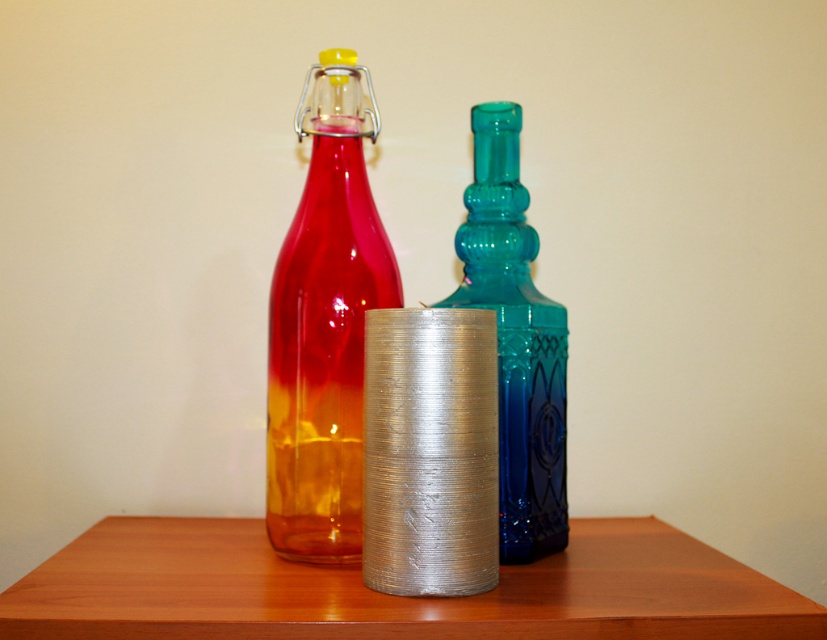
Which is below, wooden table at center or translucent amber glass bottle at center?

Positioned lower is wooden table at center.

Does point (369, 614) come farther from viewer compared to point (367, 243)?

No, (369, 614) is in front of (367, 243).

Find the location of `wooden table at center`. wooden table at center is located at coordinates (390, 595).

Locate an element on the screen. wooden table at center is located at coordinates point(390,595).

Can you confirm if wooden table at center is taller than translucent blue glass bottle at center?

In fact, wooden table at center may be shorter than translucent blue glass bottle at center.

Does point (295, 582) lie in front of point (504, 324)?

Yes.

Between point (185, 554) and point (495, 156), which one is positioned behind?

The point (495, 156) is behind.

Identify the location of wooden table at center. (390, 595).

Between translucent amber glass bottle at center and translucent blue glass bottle at center, which one appears on the right side from the viewer's perspective?

From the viewer's perspective, translucent blue glass bottle at center appears more on the right side.

The image size is (827, 640). I want to click on translucent amber glass bottle at center, so [324, 324].